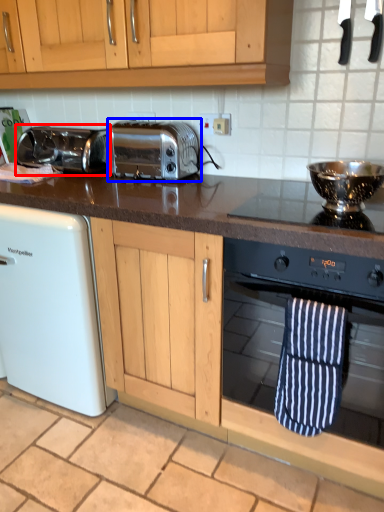
Question: Which point is closer to the camera, toaster (highlighted by a red box) or toaster (highlighted by a blue box)?

Choices:
 (A) toaster
 (B) toaster

Answer: (B)